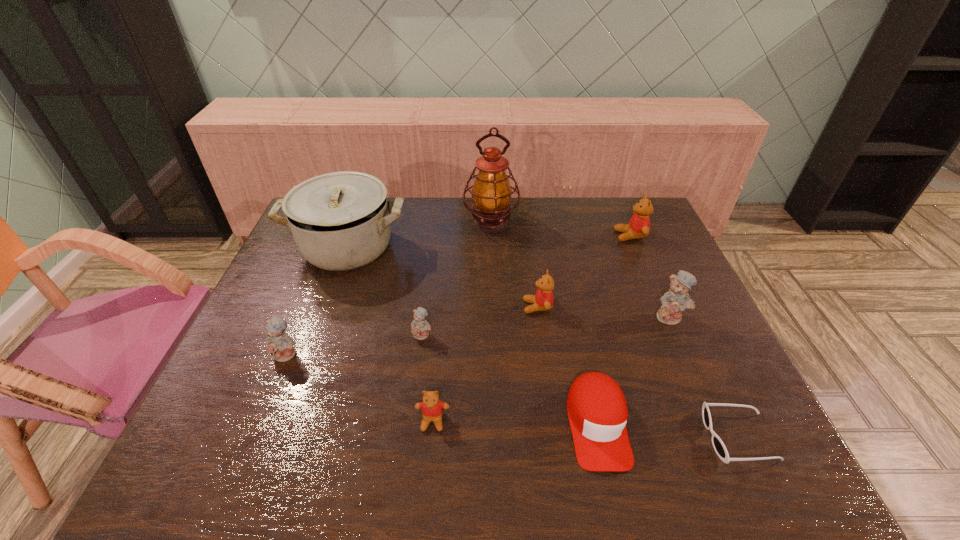
Find the location of a particular element. This screenshot has height=540, width=960. sunglasses positioned at the right edge is located at coordinates (718, 445).

Image resolution: width=960 pixels, height=540 pixels. What are the coordinates of `object located at the far left corner` in the screenshot? It's located at (340, 221).

You are a GUI agent. You are given a task and a screenshot of the screen. Output one action in this format:
    pyautogui.click(x=<x>, y=<y>)
    Task: Click on the object at the far right corner
    Image resolution: width=960 pixels, height=540 pixels.
    Given the screenshot: What is the action you would take?
    pyautogui.click(x=638, y=227)

I want to click on object situated at the near right corner, so click(718, 445).

In the image, there is a desktop. Identify the location of vacant space at the far edge. (555, 231).

I want to click on vacant area at the near edge of the desktop, so click(383, 462).

The image size is (960, 540). In the image, there is a desktop. Find the location of `vacant space at the left edge`. vacant space at the left edge is located at coordinates (239, 360).

Where is `free space at the right edge of the desktop`? free space at the right edge of the desktop is located at coordinates (664, 256).

Identify the location of free space between the nearest red teddy bear and the baseball cap. [515, 422].

The image size is (960, 540). I want to click on empty location between the sunglasses and the farthest blue teddy bear, so click(x=705, y=377).